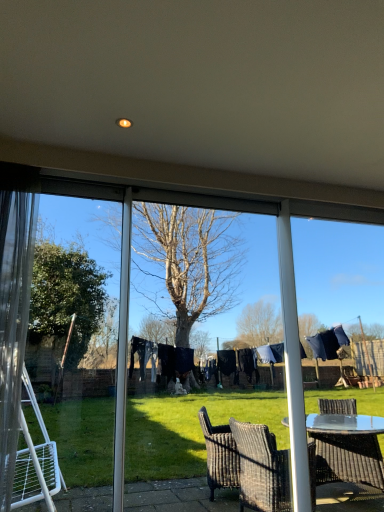
At what (x,y) coordinates should I click in order to perform the action: click on free point above clear glass window frame at right (from a real-world perspective). Please return your answer as a coordinate pair (x, y). The height and width of the screenshot is (512, 384). Looking at the image, I should click on (344, 206).